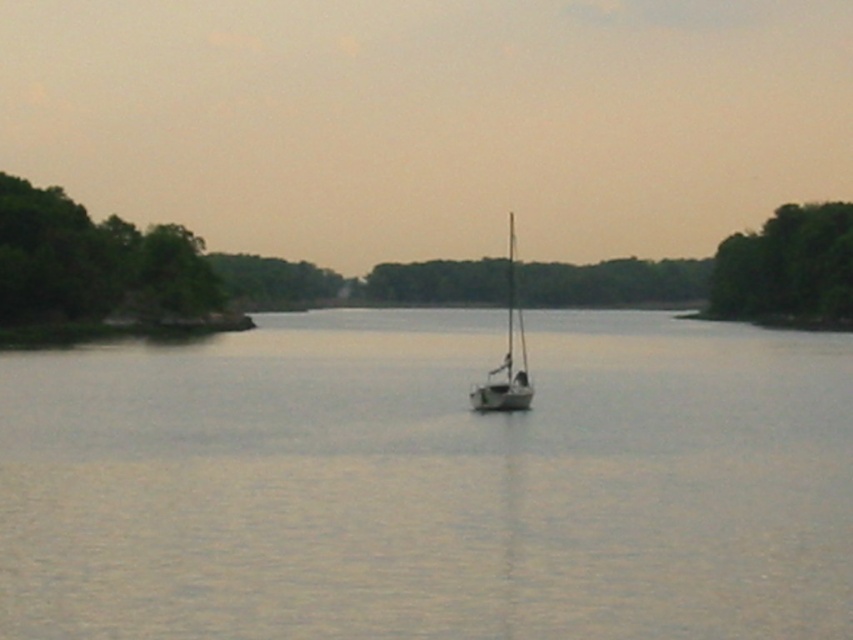
Question: Which object is the farthest from the green leafy trees at left?

Choices:
 (A) green leafy trees at right
 (B) white smooth water at center

Answer: (A)

Question: Is white smooth water at center thinner than green leafy trees at right?

Choices:
 (A) yes
 (B) no

Answer: (B)

Question: Is white smooth water at center bigger than green leafy trees at right?

Choices:
 (A) yes
 (B) no

Answer: (A)

Question: Which point appears closest to the camera in this image?

Choices:
 (A) (840, 291)
 (B) (581, 444)
 (C) (20, 298)

Answer: (B)

Question: Does white smooth water at center appear on the right side of green leafy trees at left?

Choices:
 (A) yes
 (B) no

Answer: (A)

Question: Considering the real-world distances, which object is closest to the green leafy trees at left?

Choices:
 (A) green leafy trees at right
 (B) white smooth water at center

Answer: (B)